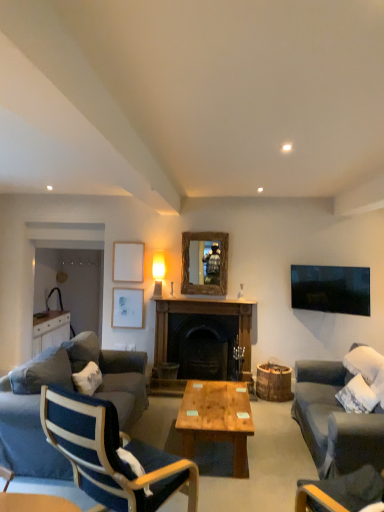
Question: Should I look upward or downward to see wooden mirror at center?

Choices:
 (A) up
 (B) down

Answer: (B)

Question: Is dark wood fireplace at center far from blue fabric couch at lower left, which is counted as the first studio couch, starting from the left?

Choices:
 (A) yes
 (B) no

Answer: (A)

Question: From the image's perspective, is dark wood fireplace at center beneath blue fabric couch at lower left, positioned as the first studio couch in back-to-front order?

Choices:
 (A) yes
 (B) no

Answer: (B)

Question: Is blue fabric couch at lower left, arranged as the 2th studio couch when viewed from the right, inside dark wood fireplace at center?

Choices:
 (A) yes
 (B) no

Answer: (B)

Question: Can you confirm if dark wood fireplace at center is smaller than blue fabric couch at lower left, arranged as the 2th studio couch when viewed from the right?

Choices:
 (A) yes
 (B) no

Answer: (A)

Question: Does dark wood fireplace at center touch blue fabric couch at lower left, positioned as the first studio couch in back-to-front order?

Choices:
 (A) yes
 (B) no

Answer: (B)

Question: Does dark wood fireplace at center have a greater width compared to blue fabric couch at lower left, positioned as the second studio couch in front-to-back order?

Choices:
 (A) no
 (B) yes

Answer: (A)

Question: Can you confirm if dark gray fabric couch at right, the 1th studio couch from the right, is positioned to the right of wooden/matte coffee table at center?

Choices:
 (A) no
 (B) yes

Answer: (B)

Question: Considering the relative sizes of dark gray fabric couch at right, which is counted as the first studio couch, starting from the front, and wooden/matte coffee table at center in the image provided, is dark gray fabric couch at right, which is counted as the first studio couch, starting from the front, shorter than wooden/matte coffee table at center?

Choices:
 (A) no
 (B) yes

Answer: (A)

Question: From the image's perspective, is dark gray fabric couch at right, arranged as the second studio couch when viewed from the left, under wooden/matte coffee table at center?

Choices:
 (A) no
 (B) yes

Answer: (A)

Question: Can you confirm if dark gray fabric couch at right, which is counted as the first studio couch, starting from the front, is taller than wooden/matte coffee table at center?

Choices:
 (A) no
 (B) yes

Answer: (B)

Question: From a real-world perspective, is dark gray fabric couch at right, arranged as the second studio couch when viewed from the left, on wooden/matte coffee table at center?

Choices:
 (A) no
 (B) yes

Answer: (B)

Question: Is dark gray fabric couch at right, arranged as the second studio couch when viewed from the back, wider than wooden/matte coffee table at center?

Choices:
 (A) yes
 (B) no

Answer: (A)

Question: Can you confirm if blue fabric couch at lower left, positioned as the second studio couch in front-to-back order, is positioned to the left of blue fabric chair at left, which is the second chair in right-to-left order?

Choices:
 (A) no
 (B) yes

Answer: (B)